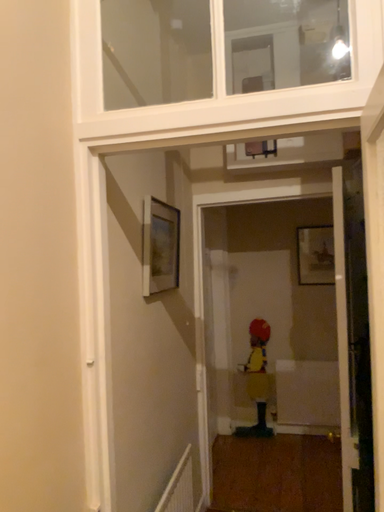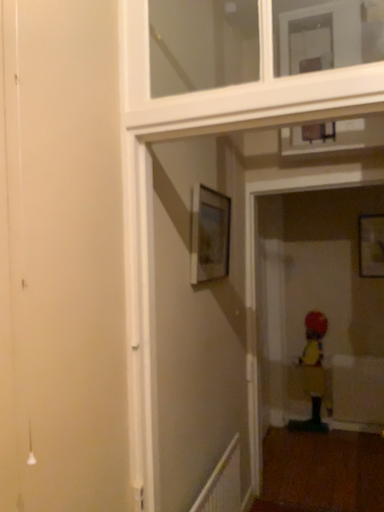
Question: How did the camera likely rotate when shooting the video?

Choices:
 (A) rotated right
 (B) rotated left

Answer: (B)